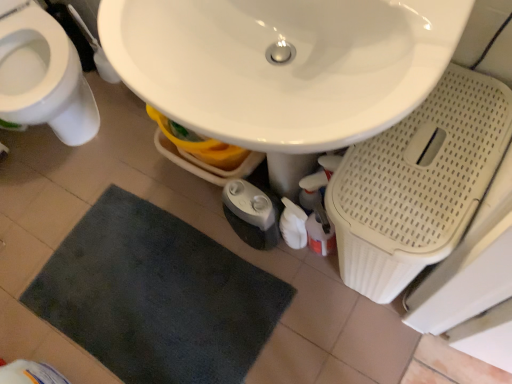
Where is `empty space that is in between white glossy toilet at left and dark gray plush bath mat at lower center`? The image size is (512, 384). empty space that is in between white glossy toilet at left and dark gray plush bath mat at lower center is located at coordinates (119, 187).